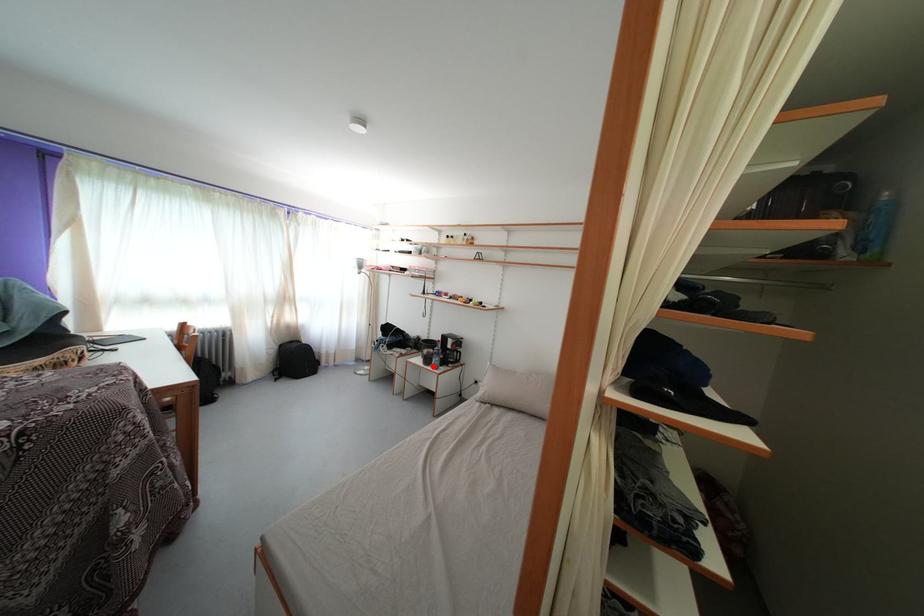
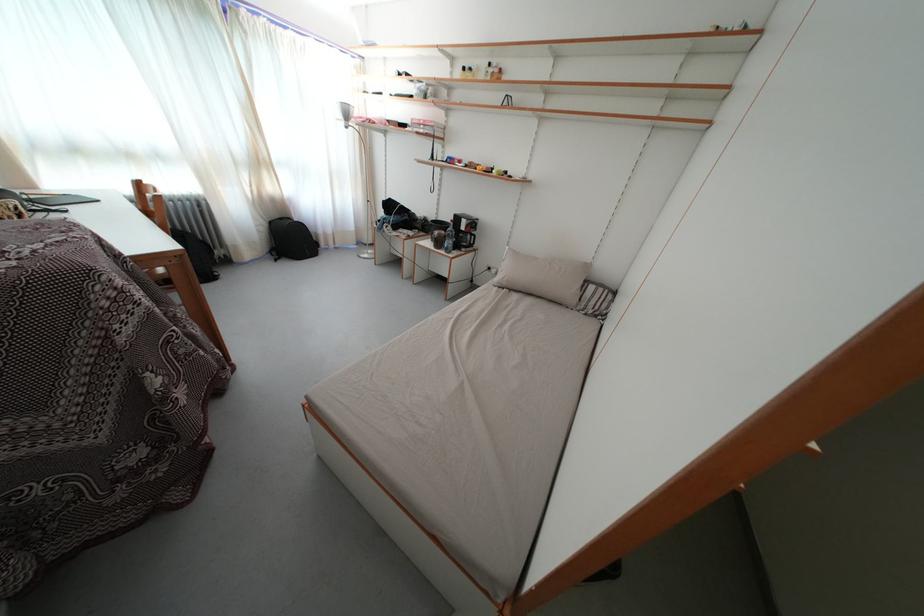
Question: A red point is marked in image1. In image2, is the corresponding 3D point closer to the camera or farther? Reply with the corresponding letter.

Choices:
 (A) The corresponding 3D point is closer.
 (B) The corresponding 3D point is farther.

Answer: (A)